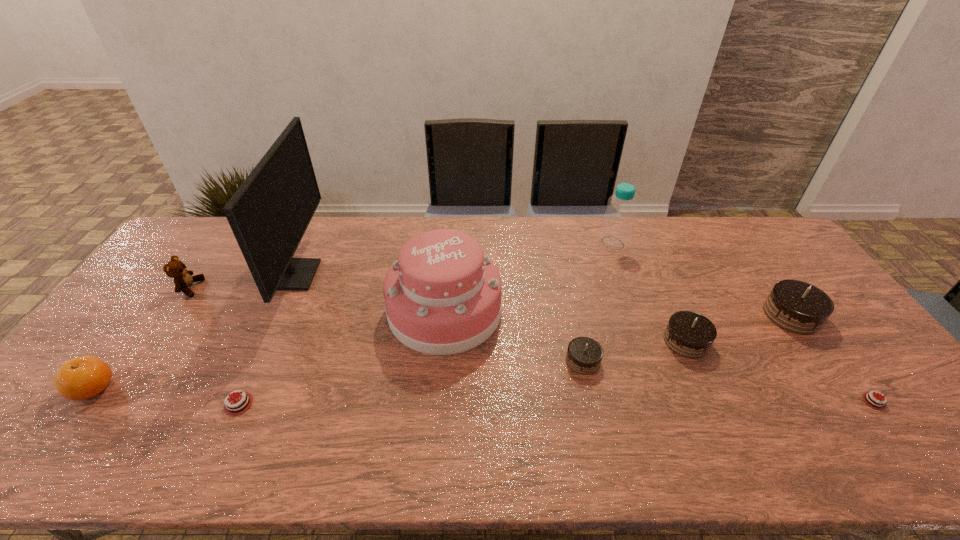
Where is `free region at the far edge of the desktop`? The width and height of the screenshot is (960, 540). free region at the far edge of the desktop is located at coordinates (410, 235).

Find the location of a particular element. This screenshot has height=540, width=960. vacant space at the near edge is located at coordinates (664, 453).

In the image, there is a desktop. At what (x,y) coordinates should I click in order to perform the action: click on free space at the far left corner. Please return your answer as a coordinate pair (x, y). The image size is (960, 540). Looking at the image, I should click on (228, 235).

Identify the location of vacant area that lies between the teddy bear and the birthday cake. The height and width of the screenshot is (540, 960). (318, 299).

The image size is (960, 540). Identify the location of free spot between the second shortest chocolate cake and the fifth object from left to right. (342, 357).

You are a GUI agent. You are given a task and a screenshot of the screen. Output one action in this format:
    pyautogui.click(x=<x>, y=<y>)
    Task: Click on the vacant space in between the bigger red chocolate cake and the second chocolate chocolate cake from left to right
    The image size is (960, 540).
    Given the screenshot: What is the action you would take?
    pyautogui.click(x=463, y=373)

Where is `free space between the ninth tallest object and the leftmost chocolate chocolate cake`? This screenshot has height=540, width=960. free space between the ninth tallest object and the leftmost chocolate chocolate cake is located at coordinates (411, 382).

Identify the location of vacant area between the ninth tallest object and the tallest object. (268, 340).

Where is `free space between the shortest chocolate cake and the brown teddy bear`? The image size is (960, 540). free space between the shortest chocolate cake and the brown teddy bear is located at coordinates (532, 345).

The width and height of the screenshot is (960, 540). I want to click on blank region between the teddy bear and the clementine, so click(x=141, y=338).